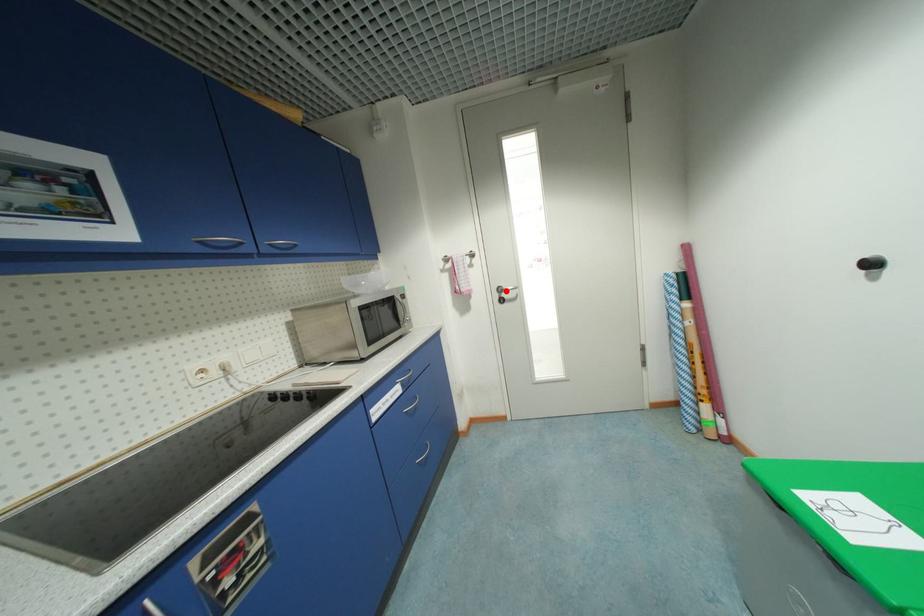
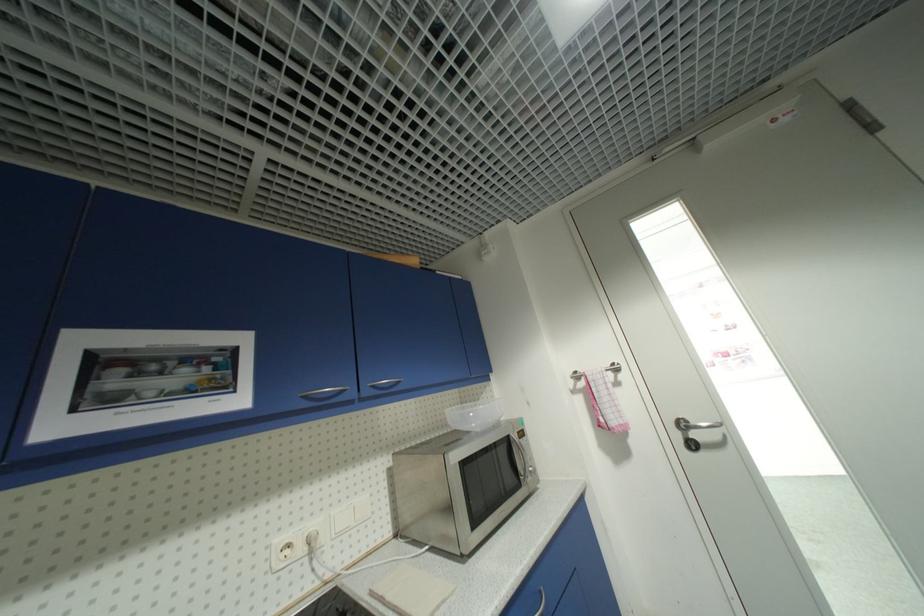
In the second image, find the point that corresponds to the highlighted location in the first image.

(688, 426)